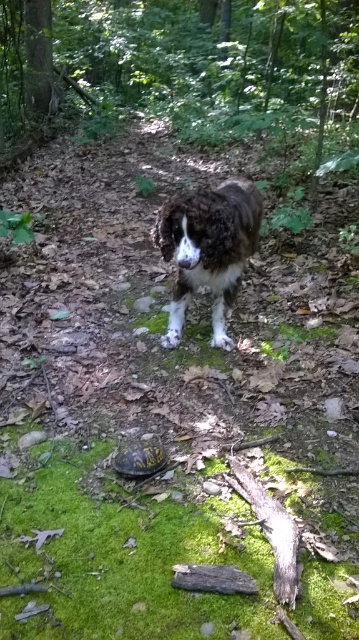
Question: Which object appears closest to the camera in this image?

Choices:
 (A) green mossy forest at center
 (B) yellow-brown textured shell at center

Answer: (B)

Question: Is green mossy forest at center closer to camera compared to yellow-brown textured shell at center?

Choices:
 (A) yes
 (B) no

Answer: (B)

Question: Among these points, which one is nearest to the camera?

Choices:
 (A) (x=199, y=285)
 (B) (x=263, y=48)
 (C) (x=140, y=460)

Answer: (C)

Question: Is brown fuzzy dog at center behind yellow-brown textured shell at center?

Choices:
 (A) no
 (B) yes

Answer: (B)

Question: Which of the following is the closest to the observer?

Choices:
 (A) (128, 460)
 (B) (218, 243)
 (C) (353, 108)

Answer: (A)

Question: Can you confirm if brown fuzzy dog at center is positioned to the right of yellow-brown textured shell at center?

Choices:
 (A) no
 (B) yes

Answer: (B)